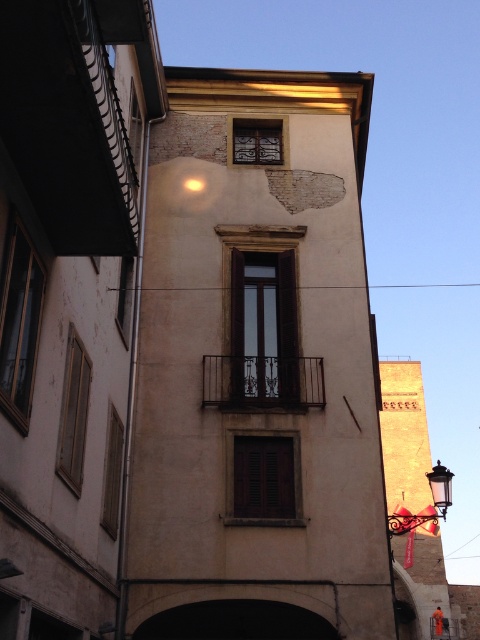
You are a window cleaner standing on a platform that can only move horizontally. You need to clean both the polished brass lantern at lower right and the metallic glass lantern at lower right. Which one should you clean first to avoid cleaning the same area twice?

You should clean the polished brass lantern at lower right first because it is in front of the metallic glass lantern at lower right. By cleaning the front one first, you can then move to the one behind without needing to revisit the area.

You are an architect analyzing the building facade. You observe the polished brass lantern at lower right and the metallic glass lantern at lower right. Which of these two lanterns is positioned lower on the building facade?

The polished brass lantern at lower right is positioned lower on the building facade because it is located below the metallic glass lantern at lower right.

You are standing in front of a multi story building and see a point marked at coordinate [432,500]. What object is located at that point?

The point at coordinate [432,500] marks the location of a polished brass lantern at lower right.